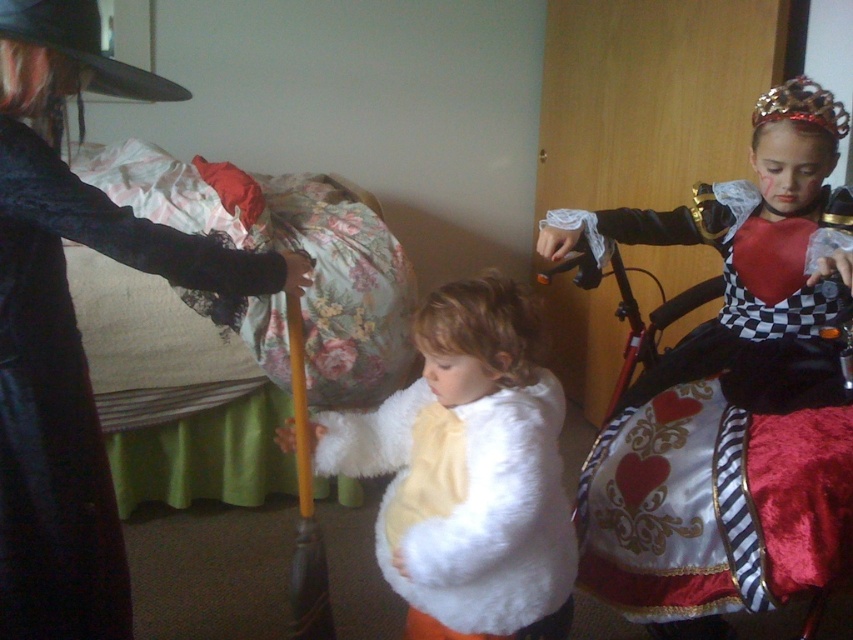
Is silky red dress at center above white fluffy vest at center?

Correct, silky red dress at center is located above white fluffy vest at center.

Which is in front, point (602, 506) or point (473, 464)?

Point (473, 464)

The width and height of the screenshot is (853, 640). Find the location of `silky red dress at center`. silky red dress at center is located at coordinates (730, 394).

How much distance is there between silky red dress at center and matte black coat at left?

silky red dress at center and matte black coat at left are 35.56 inches apart from each other.

What do you see at coordinates (730, 394) in the screenshot?
I see `silky red dress at center` at bounding box center [730, 394].

Identify the location of silky red dress at center. (730, 394).

Does matte black coat at left appear under white fluffy vest at center?

Incorrect, matte black coat at left is not positioned below white fluffy vest at center.

Who is positioned more to the left, matte black coat at left or white fluffy vest at center?

matte black coat at left

Is point (51, 452) farther from camera compared to point (421, 532)?

No, (51, 452) is in front of (421, 532).

Where is `matte black coat at left`? This screenshot has height=640, width=853. matte black coat at left is located at coordinates (73, 324).